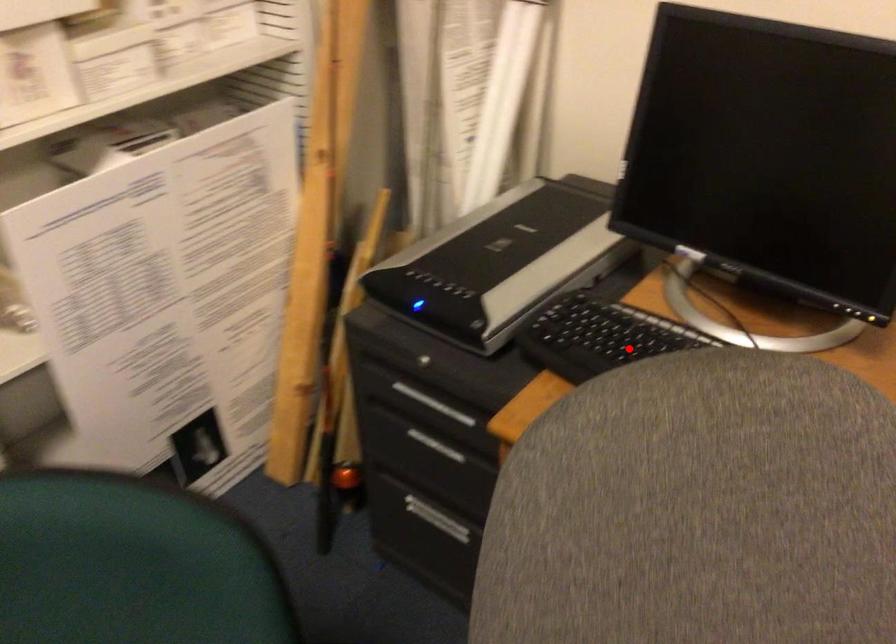
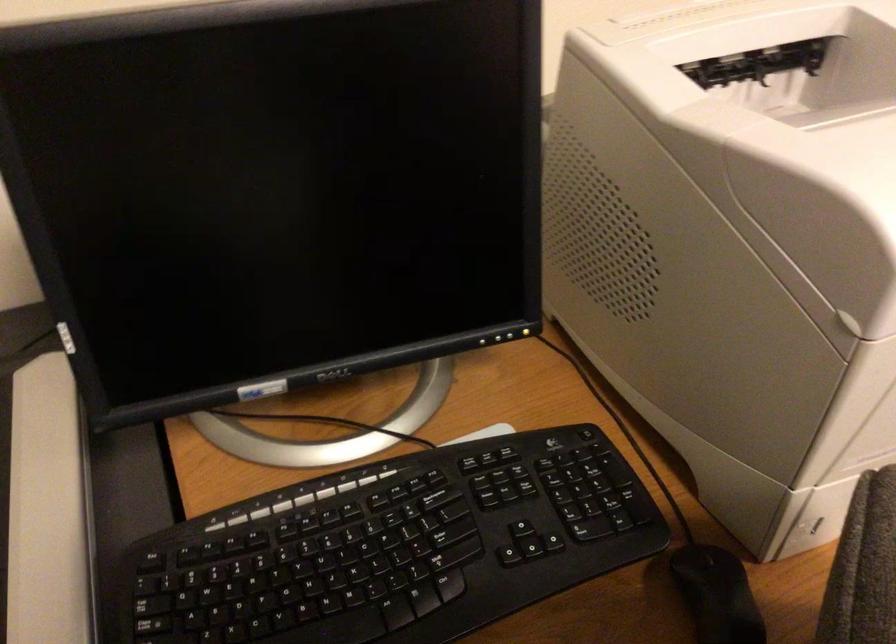
The point at the highlighted location is marked in the first image. Where is the corresponding point in the second image?

(311, 585)